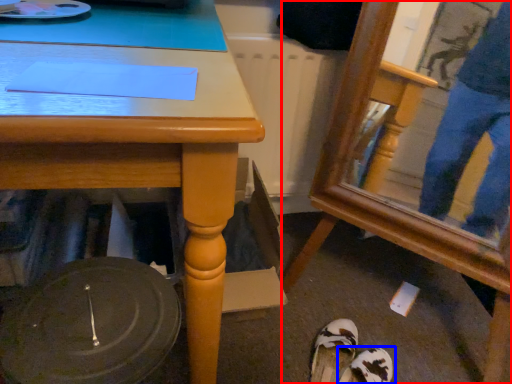
Question: Among these objects, which one is nearest to the camera, swivel chair (highlighted by a red box) or footwear (highlighted by a blue box)?

Choices:
 (A) swivel chair
 (B) footwear

Answer: (A)